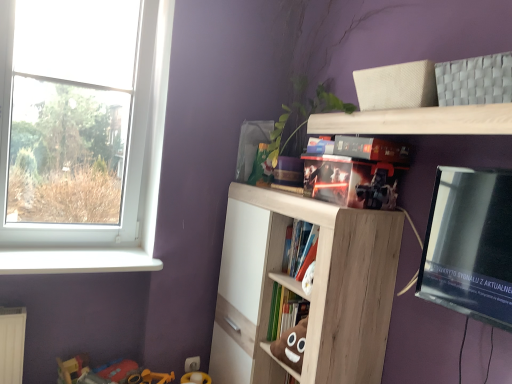
This screenshot has height=384, width=512. I want to click on vacant region under transparent glass window at left (from a real-world perspective), so click(x=59, y=246).